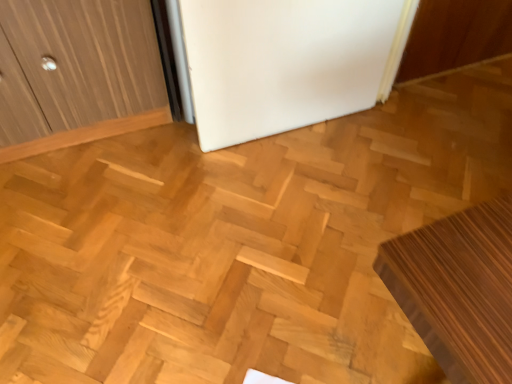
I want to click on unoccupied space behind wooden bench at lower right, so click(x=358, y=200).